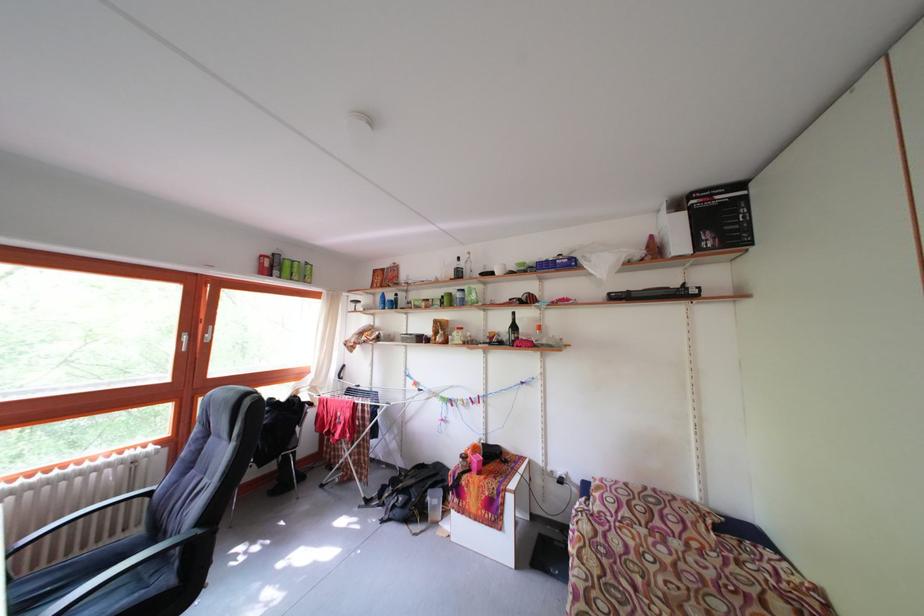
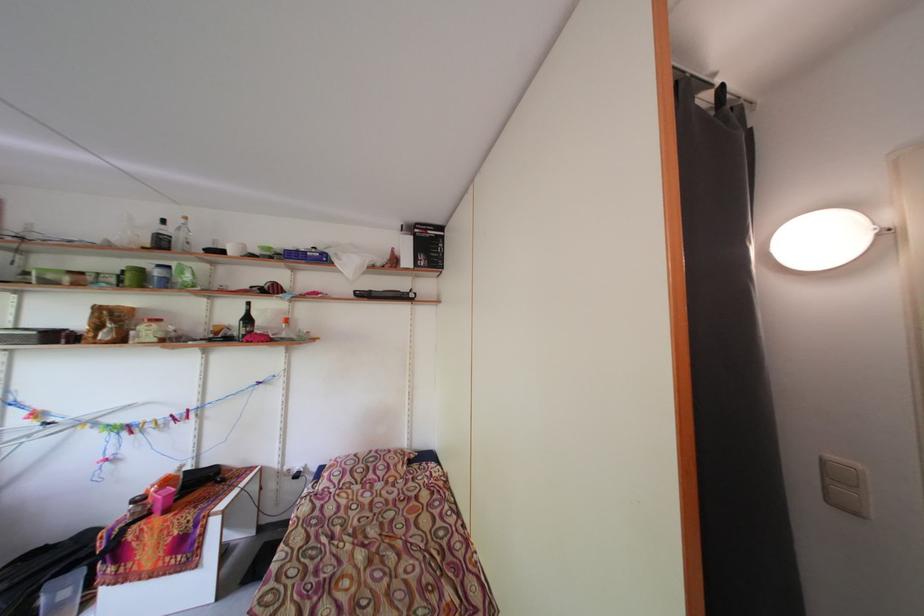
Question: The camera is either moving clockwise (left) or counter-clockwise (right) around the object. The first image is from the beginning of the video and the second image is from the end. Is the camera moving left or right when shooting the video?

Choices:
 (A) Left
 (B) Right

Answer: (A)